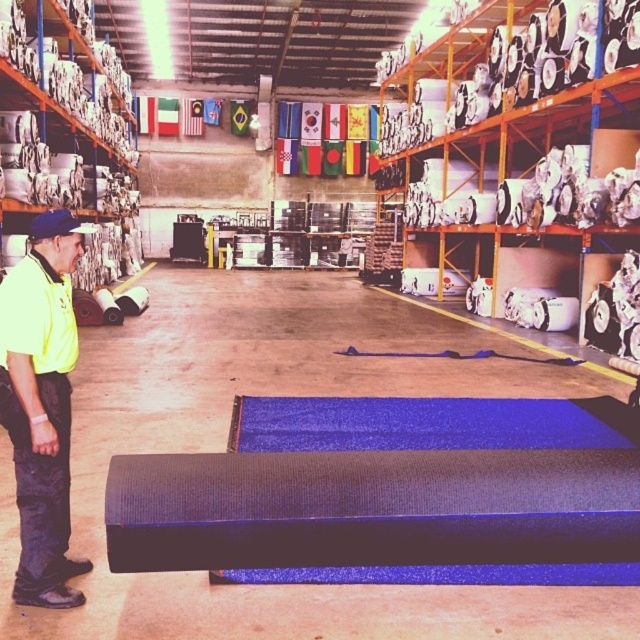
Question: Can you confirm if matte white fabric at left is smaller than yellow fabric uniform at left?

Choices:
 (A) yes
 (B) no

Answer: (B)

Question: Is matte white fabric at left thinner than yellow fabric uniform at left?

Choices:
 (A) no
 (B) yes

Answer: (A)

Question: Which of the following is the farthest from the observer?

Choices:
 (A) matte white paper at right
 (B) matte white fabric at left
 (C) yellow fabric uniform at left

Answer: (B)

Question: Which object appears farthest from the camera in this image?

Choices:
 (A) yellow fabric uniform at left
 (B) matte white paper at right

Answer: (B)

Question: Which object appears farthest from the camera in this image?

Choices:
 (A) matte white paper at right
 (B) matte white fabric at left

Answer: (B)

Question: From the image, what is the correct spatial relationship of matte white paper at right in relation to matte white fabric at left?

Choices:
 (A) below
 (B) above

Answer: (A)